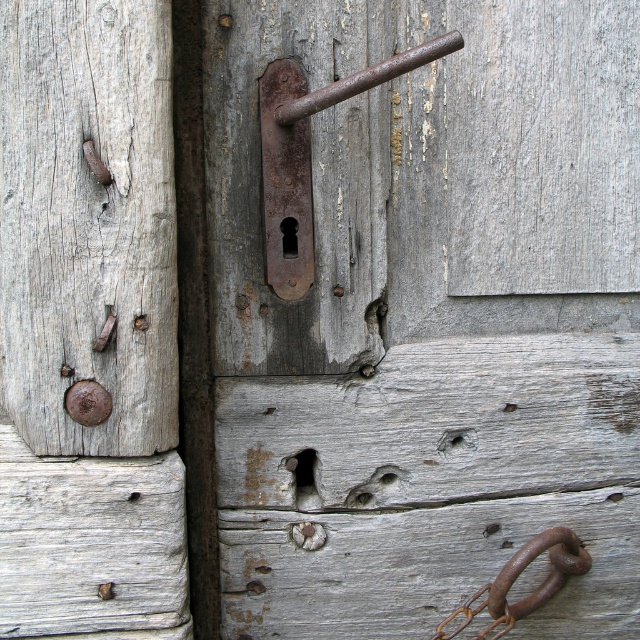
You are standing in front of the old wooden door described in the scene. There is a point marked at coordinates (428, 316). What object is located at this point?

The point at coordinates (428, 316) corresponds to the rusty metal handle at center.

You are a painter standing in front of the old wooden door. You need to paint both the rusty metal handle at center and the rusty metal hook at lower right. Which object should you paint first if you want to start with the one closest to you?

You should paint the rusty metal handle at center first because it is closer to you than the rusty metal hook at lower right.

You are a painter preparing to restore the old wooden door. You need to apply a protective coating to both the rusty metal door handle at center and the rusty metal hook at lower right. Which object should you treat first if you want to work from the top down?

The rusty metal door handle at center should be treated first because it is positioned above the rusty metal hook at lower right, allowing you to work from the top downward without obstruction.